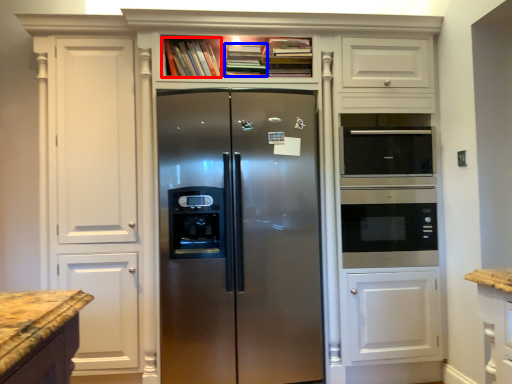
Question: Which of the following is the farthest to the observer, book (highlighted by a red box) or book (highlighted by a blue box)?

Choices:
 (A) book
 (B) book

Answer: (A)